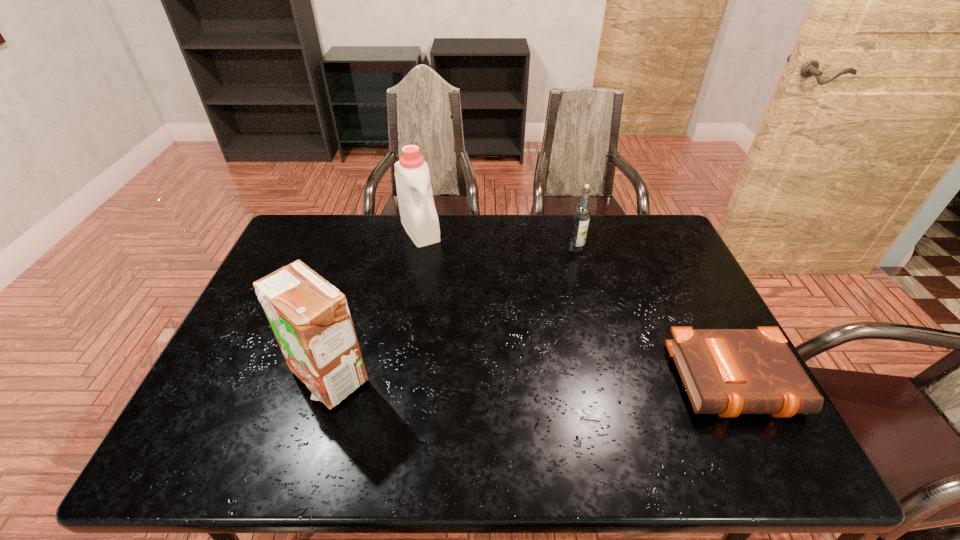
I want to click on carton, so click(310, 319).

Where is `the rightmost object`? The image size is (960, 540). the rightmost object is located at coordinates (728, 372).

This screenshot has width=960, height=540. In order to click on the shortest object in this screenshot , I will do `click(728, 372)`.

Image resolution: width=960 pixels, height=540 pixels. I want to click on detergent, so click(x=419, y=218).

I want to click on vodka, so click(x=581, y=216).

Where is `the third object from left to right`? The width and height of the screenshot is (960, 540). the third object from left to right is located at coordinates (581, 216).

Where is `vacant area situated on the handle side of the detergent`? vacant area situated on the handle side of the detergent is located at coordinates (468, 313).

At what (x,y) coordinates should I click in order to perform the action: click on vacant position located on the handle side of the detergent. Please return your answer as a coordinate pair (x, y). The height and width of the screenshot is (540, 960). Looking at the image, I should click on (443, 271).

The image size is (960, 540). In order to click on free spot located on the handle side of the detergent in this screenshot , I will do `click(453, 289)`.

Where is `vacant space situated on the label of the third object from left to right`? The height and width of the screenshot is (540, 960). vacant space situated on the label of the third object from left to right is located at coordinates (588, 335).